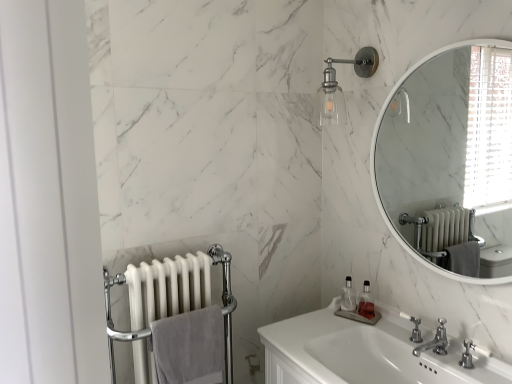
Question: Is clear glass sconce at upper center not inside clear plastic soap dispenser at lower center, positioned as the 1th soap dispenser in left-to-right order?

Choices:
 (A) no
 (B) yes

Answer: (B)

Question: Does clear glass sconce at upper center have a lesser width compared to clear plastic soap dispenser at lower center, positioned as the 1th soap dispenser in left-to-right order?

Choices:
 (A) no
 (B) yes

Answer: (A)

Question: Is clear glass sconce at upper center far away from clear plastic soap dispenser at lower center, which is the second soap dispenser in right-to-left order?

Choices:
 (A) yes
 (B) no

Answer: (B)

Question: Is clear glass sconce at upper center positioned before clear plastic soap dispenser at lower center, which is the second soap dispenser in right-to-left order?

Choices:
 (A) yes
 (B) no

Answer: (A)

Question: From a real-world perspective, is clear glass sconce at upper center beneath clear plastic soap dispenser at lower center, positioned as the 1th soap dispenser in left-to-right order?

Choices:
 (A) yes
 (B) no

Answer: (B)

Question: From their relative heights in the image, would you say clear glass sconce at upper center is taller or shorter than chrome metallic faucet at lower right, the 1th plumbing fixture in the front-to-back sequence?

Choices:
 (A) short
 (B) tall

Answer: (B)

Question: Based on their positions, is clear glass sconce at upper center located to the left or right of chrome metallic faucet at lower right, positioned as the second plumbing fixture in back-to-front order?

Choices:
 (A) right
 (B) left

Answer: (B)

Question: Is point (337, 117) closer or farther from the camera than point (472, 344)?

Choices:
 (A) closer
 (B) farther

Answer: (B)

Question: Looking at their shapes, would you say clear glass sconce at upper center is wider or thinner than chrome metallic faucet at lower right, positioned as the second plumbing fixture in back-to-front order?

Choices:
 (A) wide
 (B) thin

Answer: (A)

Question: From a real-world perspective, is clear glass sconce at upper center above or below translucent glass soap dispenser at lower center, which is counted as the 2th soap dispenser, starting from the left?

Choices:
 (A) above
 (B) below

Answer: (A)

Question: Is clear glass sconce at upper center inside or outside of translucent glass soap dispenser at lower center, which is counted as the 2th soap dispenser, starting from the left?

Choices:
 (A) inside
 (B) outside

Answer: (B)

Question: Considering the positions of clear glass sconce at upper center and translucent glass soap dispenser at lower center, arranged as the 1th soap dispenser when viewed from the right, in the image, is clear glass sconce at upper center wider or thinner than translucent glass soap dispenser at lower center, arranged as the 1th soap dispenser when viewed from the right,?

Choices:
 (A) thin
 (B) wide

Answer: (B)

Question: Is clear glass sconce at upper center in front of or behind translucent glass soap dispenser at lower center, arranged as the 1th soap dispenser when viewed from the right, in the image?

Choices:
 (A) behind
 (B) front

Answer: (B)

Question: From the image's perspective, is white plastic faucet at lower right, the second plumbing fixture positioned from the front, above or below gray cotton towel at lower left?

Choices:
 (A) below
 (B) above

Answer: (B)

Question: Based on their sizes in the image, would you say white plastic faucet at lower right, the second plumbing fixture positioned from the front, is bigger or smaller than gray cotton towel at lower left?

Choices:
 (A) small
 (B) big

Answer: (A)